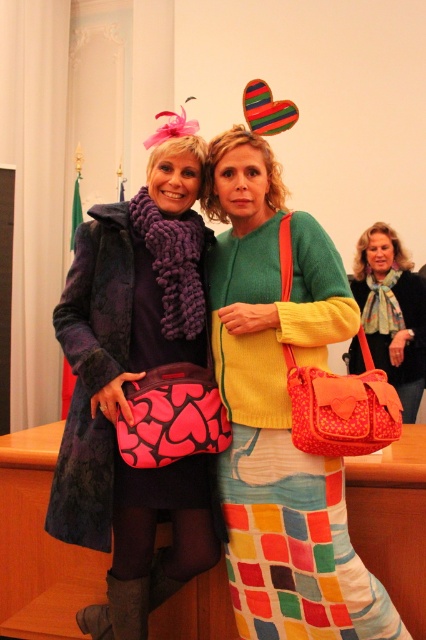
Is multicolored textured skirt at center smaller than matte pink purse at center?

No.

Does point (235, 554) lie in front of point (405, 353)?

Yes, point (235, 554) is closer to viewer.

The width and height of the screenshot is (426, 640). I want to click on multicolored textured skirt at center, so point(287,448).

Does matte purple scarf at left have a smaller size compared to multicolored textured skirt at center?

Incorrect, matte purple scarf at left is not smaller in size than multicolored textured skirt at center.

Consider the image. Does matte purple scarf at left have a greater width compared to multicolored textured skirt at center?

Incorrect, matte purple scarf at left's width does not surpass multicolored textured skirt at center's.

Where is `matte purple scarf at left`? The height and width of the screenshot is (640, 426). matte purple scarf at left is located at coordinates (135, 380).

Does matte purple scarf at left lie behind matte pink purse at center?

That is False.

Does matte purple scarf at left appear on the left side of matte pink purse at center?

Correct, you'll find matte purple scarf at left to the left of matte pink purse at center.

Describe the element at coordinates (135, 380) in the screenshot. This screenshot has width=426, height=640. I see `matte purple scarf at left` at that location.

Locate an element on the screen. This screenshot has width=426, height=640. matte purple scarf at left is located at coordinates (135, 380).